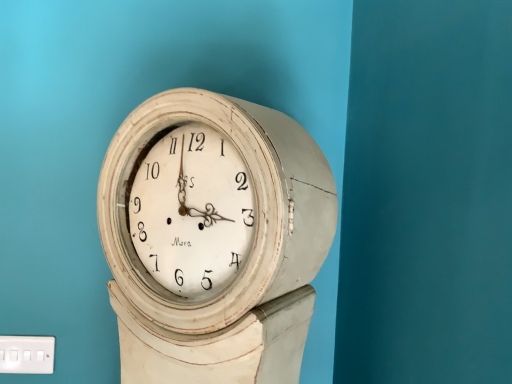
At what (x,y) coordinates should I click in order to perform the action: click on white plastic switch at lower left. Please return your answer as a coordinate pair (x, y). Looking at the image, I should click on (27, 354).

The width and height of the screenshot is (512, 384). Describe the element at coordinates (27, 354) in the screenshot. I see `white plastic switch at lower left` at that location.

You are a GUI agent. You are given a task and a screenshot of the screen. Output one action in this format:
    pyautogui.click(x=<x>, y=<y>)
    Task: Click on the white plastic switch at lower left
    Image resolution: width=512 pixels, height=384 pixels.
    Given the screenshot: What is the action you would take?
    pyautogui.click(x=27, y=354)